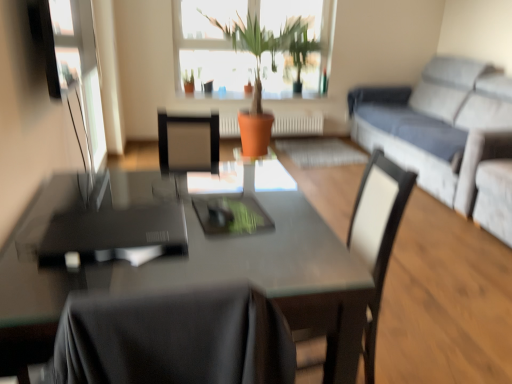
Describe the element at coordinates (260, 70) in the screenshot. Image resolution: width=512 pixels, height=384 pixels. I see `terracotta clay pot at center` at that location.

Image resolution: width=512 pixels, height=384 pixels. Describe the element at coordinates (206, 282) in the screenshot. I see `glossy glass table at center` at that location.

This screenshot has height=384, width=512. Describe the element at coordinates (377, 234) in the screenshot. I see `white leather chair at center` at that location.

This screenshot has height=384, width=512. Describe the element at coordinates (444, 131) in the screenshot. I see `light gray fabric couch at right` at that location.

Locate an element on the screen. The height and width of the screenshot is (384, 512). terracotta clay pot at center is located at coordinates (260, 70).

Would you say terracotta clay pot at center contains white leather chair at center?

No, white leather chair at center is not inside terracotta clay pot at center.

Between terracotta clay pot at center and white leather chair at center, which one has larger size?

Bigger between the two is terracotta clay pot at center.

Is terracotta clay pot at center further to camera compared to white leather chair at center?

Yes, terracotta clay pot at center is further from the camera.

Are terracotta clay pot at center and white leather chair at center located far from each other?

Absolutely, terracotta clay pot at center is distant from white leather chair at center.

From a real-world perspective, is glossy glass table at center under white leather chair at center?

Yes, from a real-world perspective, glossy glass table at center is beneath white leather chair at center.

Does glossy glass table at center have a lesser height compared to white leather chair at center?

Yes, glossy glass table at center is shorter than white leather chair at center.

Is there a large distance between glossy glass table at center and white leather chair at center?

Actually, glossy glass table at center and white leather chair at center are a little close together.

In the scene shown: From the image's perspective, is glossy glass table at center above white leather chair at center?

Actually, glossy glass table at center appears below white leather chair at center in the image.

At what (x,y) coordinates should I click in order to perform the action: click on houseplant lying above the glossy glass table at center (from the image's perspective). Please return your answer as a coordinate pair (x, y). The height and width of the screenshot is (384, 512). Looking at the image, I should click on (260, 70).

Which of these two, glossy glass table at center or terracotta clay pot at center, is thinner?

Thinner between the two is glossy glass table at center.

From the picture: Which is correct: glossy glass table at center is inside terracotta clay pot at center, or outside of it?

The correct answer is: outside.

From a real-world perspective, which object rests below the other?

light gray fabric couch at right is physically lower.

Is terracotta clay pot at center to the right of light gray fabric couch at right from the viewer's perspective?

No.

Which of these two, terracotta clay pot at center or light gray fabric couch at right, stands shorter?

Standing shorter between the two is light gray fabric couch at right.

In the scene shown: Are terracotta clay pot at center and light gray fabric couch at right located far from each other?

Indeed, terracotta clay pot at center is not near light gray fabric couch at right.

The image size is (512, 384). What are the coordinates of `houseplant that appears above the light gray fabric couch at right (from the image's perspective)` in the screenshot? It's located at point(260,70).

Looking at their sizes, would you say light gray fabric couch at right is wider or thinner than terracotta clay pot at center?

Considering their sizes, light gray fabric couch at right looks slimmer than terracotta clay pot at center.

From the picture: From the image's perspective, would you say light gray fabric couch at right is shown under terracotta clay pot at center?

A: Yes.

How distant is light gray fabric couch at right from terracotta clay pot at center?

The distance of light gray fabric couch at right from terracotta clay pot at center is 1.36 meters.

From a real-world perspective, which is physically above, glossy glass table at center or light gray fabric couch at right?

In real-world perspective, light gray fabric couch at right is above.

Would you say glossy glass table at center is to the left or to the right of light gray fabric couch at right in the picture?

Clearly, glossy glass table at center is on the left of light gray fabric couch at right in the image.

Locate an element on the screen. This screenshot has width=512, height=384. table in front of the light gray fabric couch at right is located at coordinates point(206,282).

Is glossy glass table at center in contact with light gray fabric couch at right?

There is a gap between glossy glass table at center and light gray fabric couch at right.

Can you confirm if light gray fabric couch at right is smaller than white leather chair at center?

No, light gray fabric couch at right is not smaller than white leather chair at center.

Considering the relative sizes of light gray fabric couch at right and white leather chair at center in the image provided, is light gray fabric couch at right thinner than white leather chair at center?

No, light gray fabric couch at right is not thinner than white leather chair at center.

From the picture: Would you say white leather chair at center is part of light gray fabric couch at right's contents?

No, light gray fabric couch at right does not contain white leather chair at center.

The image size is (512, 384). In order to click on chair in front of the terracotta clay pot at center in this screenshot , I will do `click(377, 234)`.

At what (x,y) coordinates should I click in order to perform the action: click on chair that appears behind the glossy glass table at center. Please return your answer as a coordinate pair (x, y). The width and height of the screenshot is (512, 384). Looking at the image, I should click on (377, 234).

From the image, which object appears to be farther from glossy glass table at center, terracotta clay pot at center or white leather chair at center?

terracotta clay pot at center lies further to glossy glass table at center than the other object.

From the image, which object appears to be farther from white leather chair at center, glossy glass table at center or light gray fabric couch at right?

Based on the image, light gray fabric couch at right appears to be further to white leather chair at center.

Estimate the real-world distances between objects in this image. Which object is further from light gray fabric couch at right, white leather chair at center or terracotta clay pot at center?

white leather chair at center.

Which object lies further to the anchor point white leather chair at center, terracotta clay pot at center or glossy glass table at center?

terracotta clay pot at center lies further to white leather chair at center than the other object.

Which object lies nearer to the anchor point terracotta clay pot at center, light gray fabric couch at right or glossy glass table at center?

Based on the image, light gray fabric couch at right appears to be nearer to terracotta clay pot at center.

Based on the photo, based on their spatial positions, is glossy glass table at center or white leather chair at center closer to terracotta clay pot at center?

The object closer to terracotta clay pot at center is white leather chair at center.

When comparing their distances from white leather chair at center, does terracotta clay pot at center or light gray fabric couch at right seem further?

terracotta clay pot at center.

Based on their spatial positions, is glossy glass table at center or light gray fabric couch at right further from terracotta clay pot at center?

glossy glass table at center is positioned further to the anchor terracotta clay pot at center.

This screenshot has height=384, width=512. I want to click on studio couch between glossy glass table at center and terracotta clay pot at center in the front-back direction, so click(x=444, y=131).

At what (x,y) coordinates should I click in order to perform the action: click on chair between glossy glass table at center and terracotta clay pot at center along the z-axis. Please return your answer as a coordinate pair (x, y). Image resolution: width=512 pixels, height=384 pixels. Looking at the image, I should click on (377, 234).

At what (x,y) coordinates should I click in order to perform the action: click on chair situated between glossy glass table at center and light gray fabric couch at right from left to right. Please return your answer as a coordinate pair (x, y). The image size is (512, 384). Looking at the image, I should click on (377, 234).

Image resolution: width=512 pixels, height=384 pixels. I want to click on studio couch between white leather chair at center and terracotta clay pot at center along the z-axis, so click(444, 131).